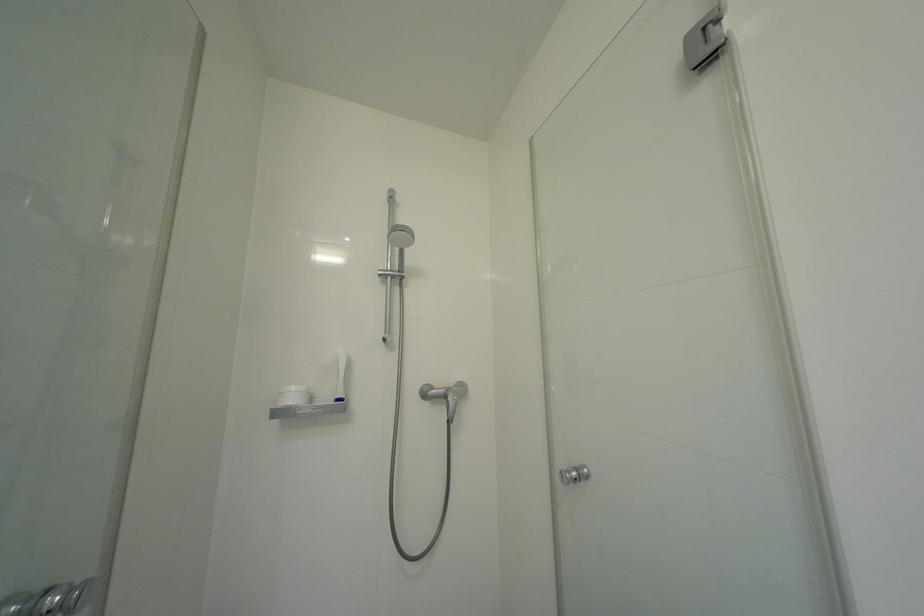
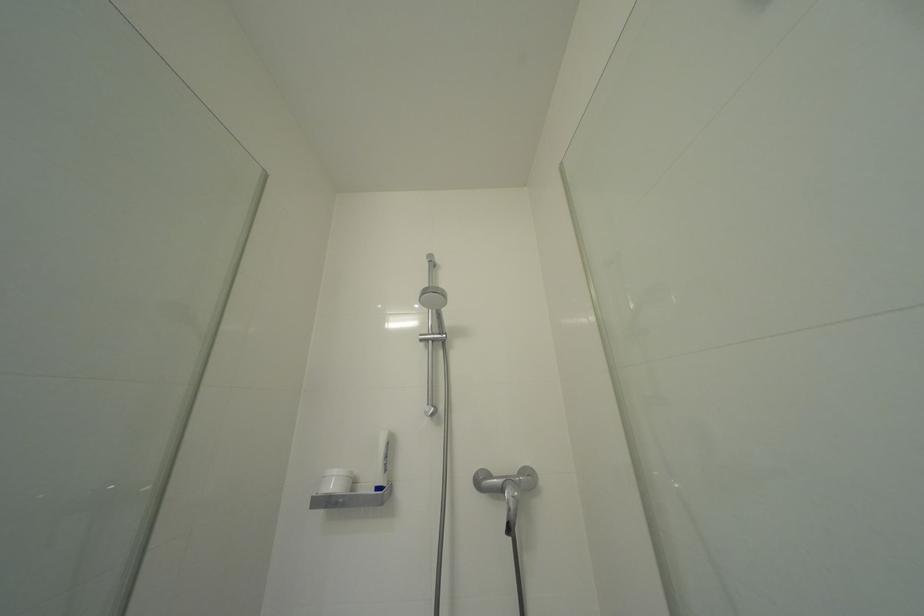
Which direction would the cameraman need to move to produce the second image?

The cameraman walked toward right, forward.